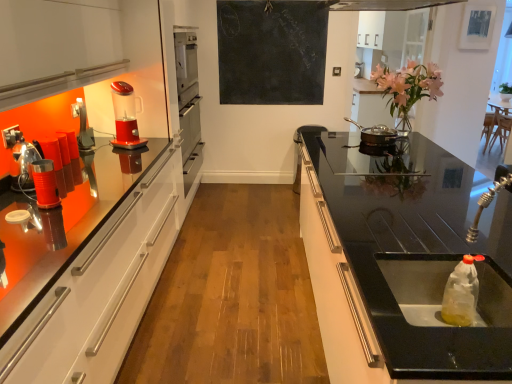
Identify the location of free space above black chalkboard at upper center (from a real-world perspective). (271, 4).